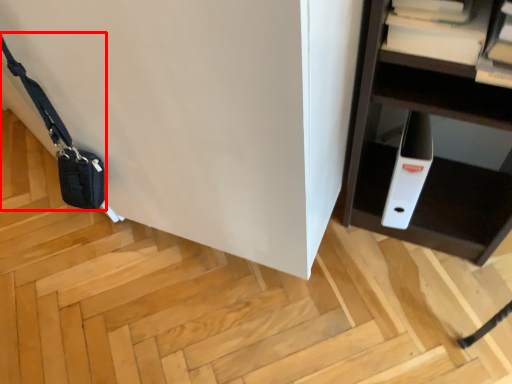
Question: From the image's perspective, what is the correct spatial relationship of messenger bag (annotated by the red box) in relation to book?

Choices:
 (A) below
 (B) above

Answer: (A)